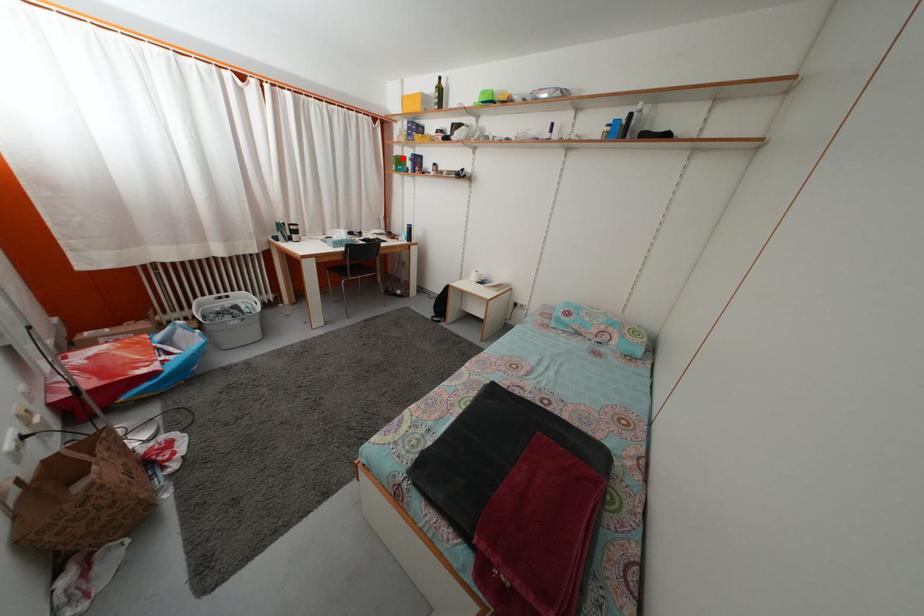
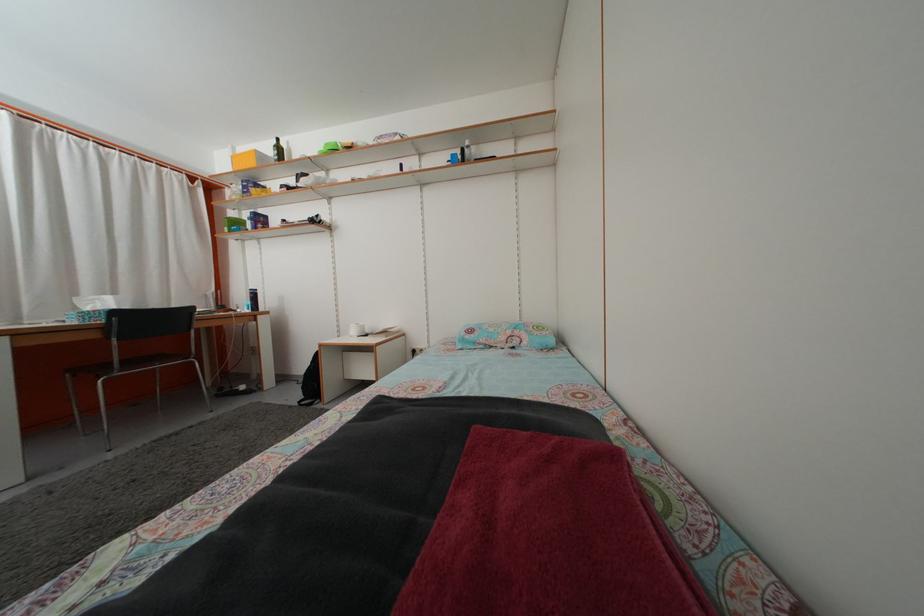
In the second image, find the point that corresponds to the highlighted location in the first image.

(237, 223)